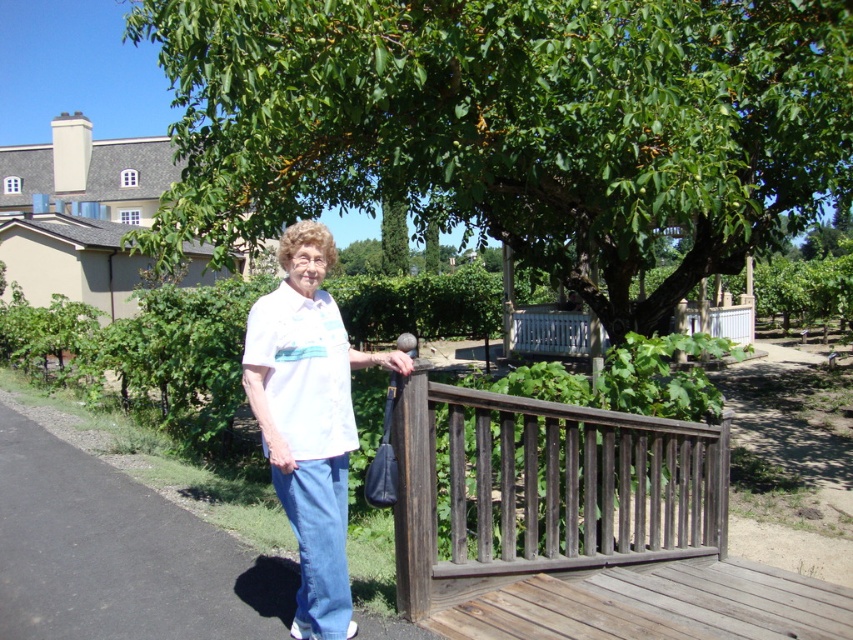
Question: Is smooth asphalt path at center smaller than weathered wood deck at lower right?

Choices:
 (A) no
 (B) yes

Answer: (B)

Question: Which of the following is the farthest from the observer?

Choices:
 (A) (724, 596)
 (B) (331, 502)
 (C) (231, 93)

Answer: (C)

Question: Does green leafy tree at center appear over white matte shirt at center?

Choices:
 (A) yes
 (B) no

Answer: (A)

Question: Which point is closer to the camera taking this photo?

Choices:
 (A) (339, 374)
 (B) (734, 186)

Answer: (A)

Question: Considering the relative positions of white matte shirt at center and weathered wood deck at lower right in the image provided, where is white matte shirt at center located with respect to weathered wood deck at lower right?

Choices:
 (A) above
 (B) below

Answer: (A)

Question: Which object is the closest to the smooth asphalt path at center?

Choices:
 (A) green leafy tree at center
 (B) weathered wood deck at lower right
 (C) dark brown wood at center

Answer: (C)